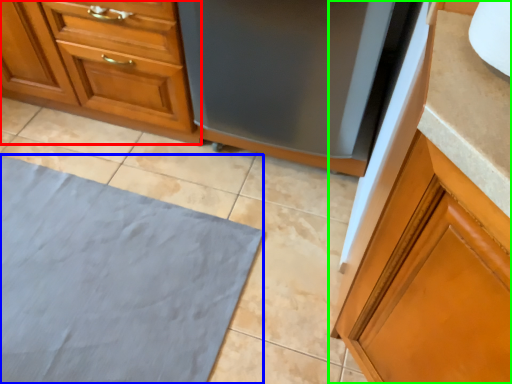
Question: Considering the real-world distances, which object is closest to cabinetry (highlighted by a red box)? bath mat (highlighted by a blue box) or cabinetry (highlighted by a green box).

Choices:
 (A) bath mat
 (B) cabinetry

Answer: (A)